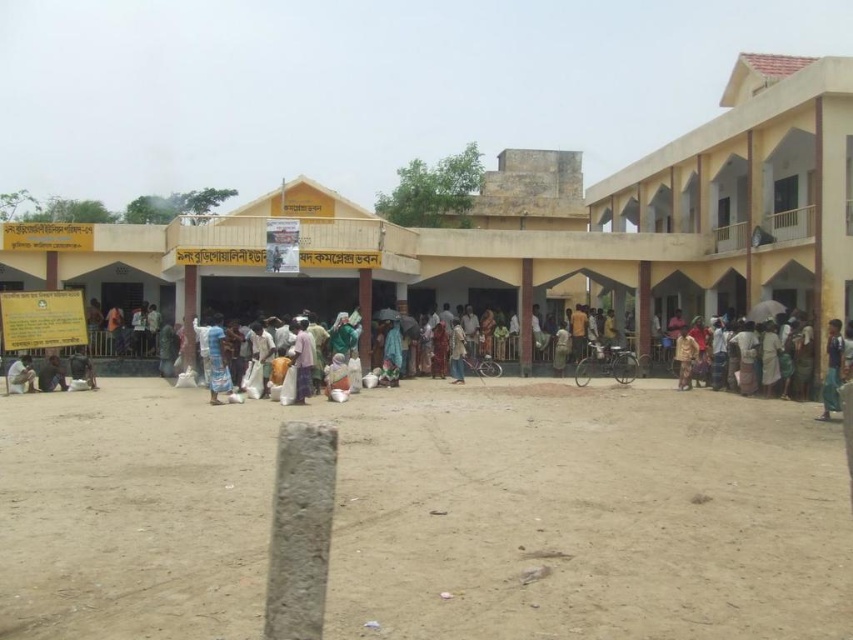
Does brown sandy ground at center have a greater width compared to dark green fabric bag at lower left?

Correct, the width of brown sandy ground at center exceeds that of dark green fabric bag at lower left.

Does brown sandy ground at center have a smaller size compared to dark green fabric bag at lower left?

Incorrect, brown sandy ground at center is not smaller in size than dark green fabric bag at lower left.

The image size is (853, 640). Identify the location of brown sandy ground at center. (431, 515).

This screenshot has width=853, height=640. In order to click on brown sandy ground at center in this screenshot , I will do `click(431, 515)`.

Which is below, dark green fabric bag at lower left or white cotton cloth at center?

white cotton cloth at center is below.

Is dark green fabric bag at lower left shorter than white cotton cloth at center?

Yes.

The image size is (853, 640). What are the coordinates of `dark green fabric bag at lower left` in the screenshot? It's located at (80, 369).

Does point (41, 385) come in front of point (83, 376)?

Yes, point (41, 385) is closer to viewer.

Is point (44, 384) closer to viewer compared to point (84, 372)?

That is True.

This screenshot has width=853, height=640. What are the coordinates of `dark green fabric at lower left` in the screenshot? It's located at (51, 372).